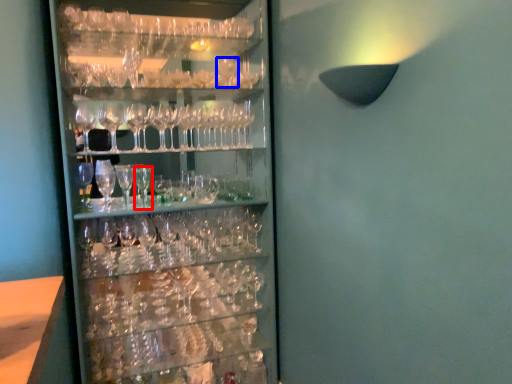
Question: Which point is closer to the camera, beer glass (highlighted by a red box) or wine glass (highlighted by a blue box)?

Choices:
 (A) beer glass
 (B) wine glass

Answer: (A)